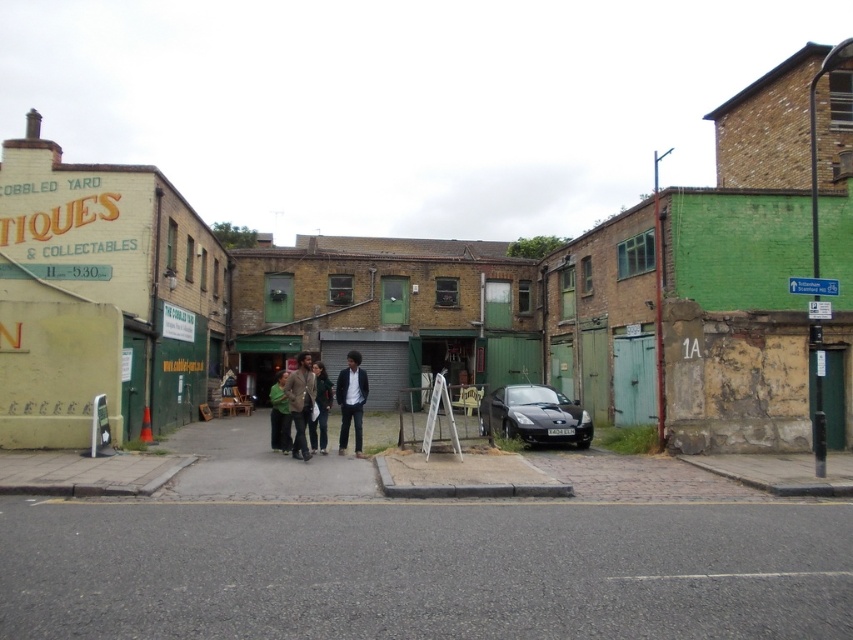
You are a pedestrian standing on the pavement near the green door. You see a shiny black car at center and a green fabric jacket at center. Which object is positioned to the right of the other?

The shiny black car at center is to the right of the green fabric jacket at center.